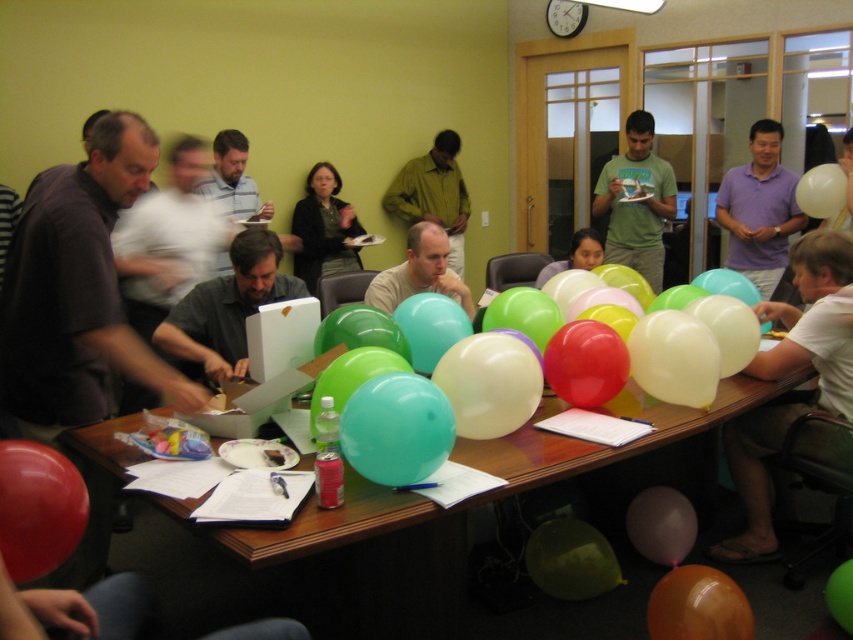
You are a photographer standing in the room and want to capture a closeup shot of the teal glossy balloon at center. If your camera can focus on objects within 1.5 meters, will you need to move closer or farther away to get a clear photo?

The teal glossy balloon at center is 1.76 meters away from the camera. Since your camera focuses within 1.5 meters, you need to move closer to reduce the distance to within the focus range.

From the picture: You are organizing a party and need to determine which item takes up more space on the table. Which one is larger between the rubberized red balloon at lower left and the purple matte shirt at upper right?

The purple matte shirt at upper right occupies more space than the rubberized red balloon at lower left.

You are standing at the entrance of the room and want to locate the teal glossy balloon at center. According to the coordinates provided, where should you look relative to the room?

The teal glossy balloon at center is located at coordinates point (396, 428), which means it is positioned towards the upper right side of the room.